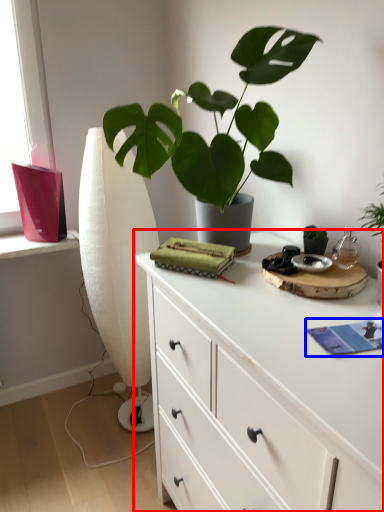
Question: Among these objects, which one is farthest to the camera, chest of drawers (highlighted by a red box) or book (highlighted by a blue box)?

Choices:
 (A) chest of drawers
 (B) book

Answer: (B)